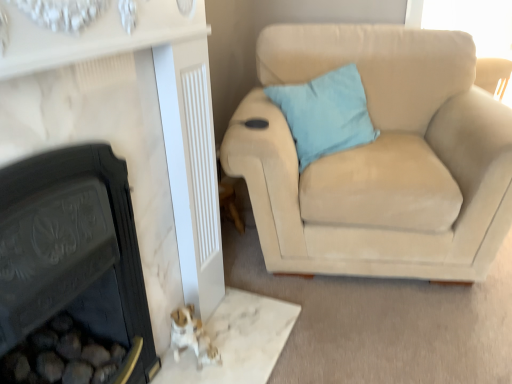
How much space does matte black fireplace at lower left, positioned as the first fireplace in right-to-left order, occupy horizontally?

matte black fireplace at lower left, positioned as the first fireplace in right-to-left order, is 4.69 inches in width.

Measure the distance between light blue fabric pillow at upper right and camera.

A distance of 5.67 feet exists between light blue fabric pillow at upper right and camera.

You are a GUI agent. You are given a task and a screenshot of the screen. Output one action in this format:
    pyautogui.click(x=<x>, y=<y>)
    Task: Click on the suede beige couch at right
    The image size is (512, 384).
    Given the screenshot: What is the action you would take?
    pyautogui.click(x=379, y=158)

Considering the sizes of objects suede beige couch at right and light blue fabric pillow at upper right in the image provided, who is shorter, suede beige couch at right or light blue fabric pillow at upper right?

light blue fabric pillow at upper right.

Is suede beige couch at right facing towards light blue fabric pillow at upper right?

Yes.

Which object is positioned more to the right, suede beige couch at right or light blue fabric pillow at upper right?

Positioned to the right is suede beige couch at right.

In the scene shown: From the image's perspective, is suede beige couch at right beneath light blue fabric pillow at upper right?

Yes, from the image's perspective, suede beige couch at right is beneath light blue fabric pillow at upper right.

Is matte black fireplace at lower left, the second fireplace in the left-to-right sequence, oriented towards light blue fabric pillow at upper right?

No, matte black fireplace at lower left, the second fireplace in the left-to-right sequence, is not aimed at light blue fabric pillow at upper right.

Are matte black fireplace at lower left, the second fireplace in the left-to-right sequence, and light blue fabric pillow at upper right making contact?

No, matte black fireplace at lower left, the second fireplace in the left-to-right sequence, is not next to light blue fabric pillow at upper right.

Is matte black fireplace at lower left, the second fireplace in the left-to-right sequence, wider than light blue fabric pillow at upper right?

In fact, matte black fireplace at lower left, the second fireplace in the left-to-right sequence, might be narrower than light blue fabric pillow at upper right.

Considering the relative sizes of matte black fireplace at lower left, the second fireplace in the left-to-right sequence, and light blue fabric pillow at upper right in the image provided, is matte black fireplace at lower left, the second fireplace in the left-to-right sequence, smaller than light blue fabric pillow at upper right?

No.

Is light blue fabric pillow at upper right bigger than matte black fireplace at lower left, positioned as the first fireplace in right-to-left order?

No.

From a real-world perspective, who is located lower, light blue fabric pillow at upper right or matte black fireplace at lower left, the second fireplace in the left-to-right sequence?

From a 3D spatial view, matte black fireplace at lower left, the second fireplace in the left-to-right sequence, is below.

The width and height of the screenshot is (512, 384). I want to click on pillow above the matte black fireplace at lower left, positioned as the first fireplace in right-to-left order (from a real-world perspective), so 325,113.

Is point (316, 120) closer or farther from the camera than point (194, 293)?

Clearly, point (316, 120) is more distant from the camera than point (194, 293).

From the image's perspective, between light blue fabric pillow at upper right and suede beige couch at right, who is located below?

suede beige couch at right appears lower in the image.

Can we say light blue fabric pillow at upper right lies outside suede beige couch at right?

Actually, light blue fabric pillow at upper right is within suede beige couch at right.

Which point is more forward, [333,133] or [322,34]?

The point [333,133] is closer.

Between suede beige couch at right and black cast iron fireplace at lower left, which is the 1th fireplace in left-to-right order, which one is positioned in front?

black cast iron fireplace at lower left, which is the 1th fireplace in left-to-right order.

From the picture: Which of these two, suede beige couch at right or black cast iron fireplace at lower left, the second fireplace positioned from the right, is smaller?

black cast iron fireplace at lower left, the second fireplace positioned from the right.

Which object is wider, suede beige couch at right or black cast iron fireplace at lower left, the second fireplace positioned from the right?

suede beige couch at right is wider.

Measure the distance between suede beige couch at right and black cast iron fireplace at lower left, the second fireplace positioned from the right.

The distance of suede beige couch at right from black cast iron fireplace at lower left, the second fireplace positioned from the right, is 36.56 inches.

Is suede beige couch at right far away from matte black fireplace at lower left, positioned as the first fireplace in right-to-left order?

suede beige couch at right is actually quite close to matte black fireplace at lower left, positioned as the first fireplace in right-to-left order.

From a real-world perspective, between suede beige couch at right and matte black fireplace at lower left, positioned as the first fireplace in right-to-left order, who is vertically higher?

matte black fireplace at lower left, positioned as the first fireplace in right-to-left order, is physically above.

Between suede beige couch at right and matte black fireplace at lower left, the second fireplace in the left-to-right sequence, which one is positioned behind?

Positioned behind is suede beige couch at right.

Does black cast iron fireplace at lower left, the second fireplace positioned from the right, have a lesser width compared to light blue fabric pillow at upper right?

Yes, black cast iron fireplace at lower left, the second fireplace positioned from the right, is thinner than light blue fabric pillow at upper right.

Can you tell me how much black cast iron fireplace at lower left, which is the 1th fireplace in left-to-right order, and light blue fabric pillow at upper right differ in facing direction?

39.9 degrees separate the facing orientations of black cast iron fireplace at lower left, which is the 1th fireplace in left-to-right order, and light blue fabric pillow at upper right.

Considering the relative positions of black cast iron fireplace at lower left, which is the 1th fireplace in left-to-right order, and light blue fabric pillow at upper right in the image provided, is black cast iron fireplace at lower left, which is the 1th fireplace in left-to-right order, in front of light blue fabric pillow at upper right?

Yes, black cast iron fireplace at lower left, which is the 1th fireplace in left-to-right order, is in front of light blue fabric pillow at upper right.

Where is `studio couch located on the right of light blue fabric pillow at upper right`? studio couch located on the right of light blue fabric pillow at upper right is located at coordinates (379, 158).

Where is `the 1st fireplace positioned below the light blue fabric pillow at upper right (from the image's perspective)`? The image size is (512, 384). the 1st fireplace positioned below the light blue fabric pillow at upper right (from the image's perspective) is located at coordinates (133, 124).

Looking at the image, which one is located further to suede beige couch at right, matte black fireplace at lower left, positioned as the first fireplace in right-to-left order, or black cast iron fireplace at lower left, which is the 1th fireplace in left-to-right order?

Among the two, black cast iron fireplace at lower left, which is the 1th fireplace in left-to-right order, is located further to suede beige couch at right.

In the scene shown: Which object lies further to the anchor point suede beige couch at right, light blue fabric pillow at upper right or matte black fireplace at lower left, the second fireplace in the left-to-right sequence?

matte black fireplace at lower left, the second fireplace in the left-to-right sequence, is further to suede beige couch at right.

Estimate the real-world distances between objects in this image. Which object is closer to matte black fireplace at lower left, the second fireplace in the left-to-right sequence, light blue fabric pillow at upper right or suede beige couch at right?

The object closer to matte black fireplace at lower left, the second fireplace in the left-to-right sequence, is suede beige couch at right.

Based on the photo, based on their spatial positions, is matte black fireplace at lower left, positioned as the first fireplace in right-to-left order, or suede beige couch at right closer to light blue fabric pillow at upper right?

suede beige couch at right is positioned closer to the anchor light blue fabric pillow at upper right.

Estimate the real-world distances between objects in this image. Which object is further from suede beige couch at right, light blue fabric pillow at upper right or black cast iron fireplace at lower left, the second fireplace positioned from the right?

black cast iron fireplace at lower left, the second fireplace positioned from the right, lies further to suede beige couch at right than the other object.

Consider the image. Based on their spatial positions, is suede beige couch at right or matte black fireplace at lower left, the second fireplace in the left-to-right sequence, further from black cast iron fireplace at lower left, which is the 1th fireplace in left-to-right order?

suede beige couch at right.

When comparing their distances from black cast iron fireplace at lower left, which is the 1th fireplace in left-to-right order, does matte black fireplace at lower left, positioned as the first fireplace in right-to-left order, or suede beige couch at right seem further?

The object further to black cast iron fireplace at lower left, which is the 1th fireplace in left-to-right order, is suede beige couch at right.

Based on their spatial positions, is suede beige couch at right or light blue fabric pillow at upper right further from matte black fireplace at lower left, positioned as the first fireplace in right-to-left order?

Based on the image, light blue fabric pillow at upper right appears to be further to matte black fireplace at lower left, positioned as the first fireplace in right-to-left order.

Find the location of a particular element. The width and height of the screenshot is (512, 384). studio couch located between matte black fireplace at lower left, positioned as the first fireplace in right-to-left order, and light blue fabric pillow at upper right in the depth direction is located at coordinates (379, 158).

Identify the location of fireplace located between black cast iron fireplace at lower left, the second fireplace positioned from the right, and suede beige couch at right in the left-right direction. The height and width of the screenshot is (384, 512). coord(133,124).

The height and width of the screenshot is (384, 512). Find the location of `studio couch between black cast iron fireplace at lower left, the second fireplace positioned from the right, and light blue fabric pillow at upper right, along the z-axis`. studio couch between black cast iron fireplace at lower left, the second fireplace positioned from the right, and light blue fabric pillow at upper right, along the z-axis is located at coordinates coord(379,158).

Find the location of a particular element. This screenshot has height=384, width=512. fireplace between matte black fireplace at lower left, positioned as the first fireplace in right-to-left order, and light blue fabric pillow at upper right in the front-back direction is located at coordinates (74, 253).